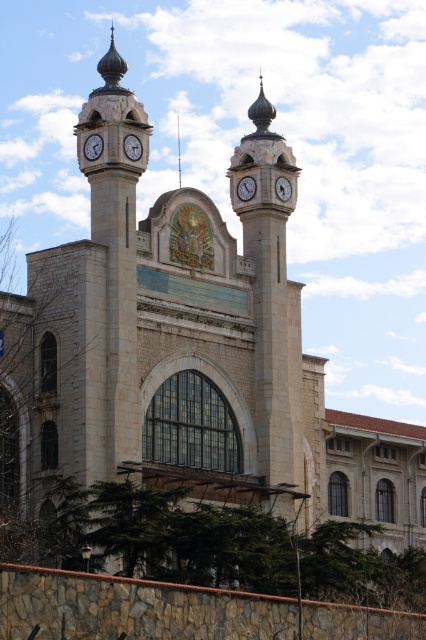
Question: Which object appears farthest from the camera in this image?

Choices:
 (A) matte white clock at upper center
 (B) white glossy clock at upper center
 (C) white glossy clock at center
 (D) matte white clock at left

Answer: (A)

Question: Which point appears closest to the camera in this image?

Choices:
 (A) (279, 182)
 (B) (131, 145)
 (C) (238, 184)

Answer: (B)

Question: Is the position of matte white clock at left less distant than that of white glossy clock at center?

Choices:
 (A) yes
 (B) no

Answer: (B)

Question: Does matte white clock at left have a smaller size compared to white glossy clock at center?

Choices:
 (A) no
 (B) yes

Answer: (B)

Question: Is matte white clock at left thinner than white glossy clock at upper center?

Choices:
 (A) yes
 (B) no

Answer: (A)

Question: Which point is closer to the camera?

Choices:
 (A) (276, 193)
 (B) (135, 141)

Answer: (B)